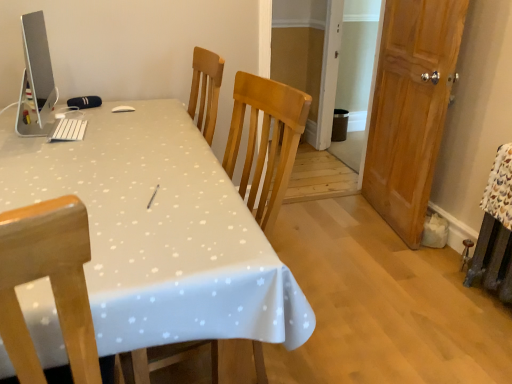
Locate an element on the screen. The width and height of the screenshot is (512, 384). vacant region in front of wooden door at right is located at coordinates (397, 264).